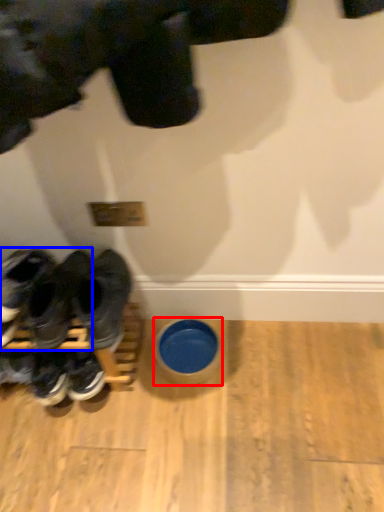
Question: Among these objects, which one is farthest to the camera, bowl (highlighted by a red box) or footwear (highlighted by a blue box)?

Choices:
 (A) bowl
 (B) footwear

Answer: (A)